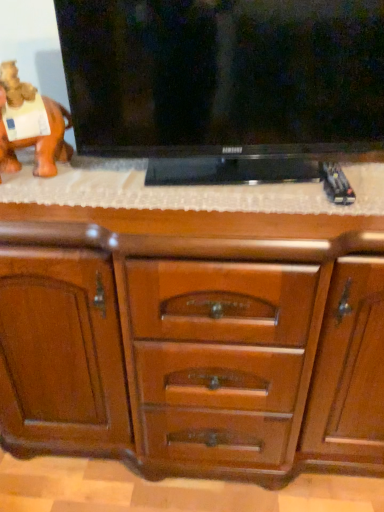
Question: Should I look upward or downward to see black glossy flat-screen tv at upper center?

Choices:
 (A) down
 (B) up

Answer: (B)

Question: Is there a large distance between wooden chest of drawers at center and black glossy flat-screen tv at upper center?

Choices:
 (A) yes
 (B) no

Answer: (B)

Question: From the image's perspective, does wooden chest of drawers at center appear lower than black glossy flat-screen tv at upper center?

Choices:
 (A) no
 (B) yes

Answer: (B)

Question: Can you see wooden chest of drawers at center touching black glossy flat-screen tv at upper center?

Choices:
 (A) yes
 (B) no

Answer: (B)

Question: Is wooden chest of drawers at center to the right of black glossy flat-screen tv at upper center from the viewer's perspective?

Choices:
 (A) yes
 (B) no

Answer: (B)

Question: Could you tell me if wooden chest of drawers at center is turned towards black glossy flat-screen tv at upper center?

Choices:
 (A) no
 (B) yes

Answer: (A)

Question: Is wooden chest of drawers at center outside of black glossy flat-screen tv at upper center?

Choices:
 (A) yes
 (B) no

Answer: (A)

Question: Is wooden chest of drawers at center positioned before orange matte elephant at left?

Choices:
 (A) yes
 (B) no

Answer: (A)

Question: Is orange matte elephant at left inside wooden chest of drawers at center?

Choices:
 (A) no
 (B) yes

Answer: (A)

Question: Does wooden chest of drawers at center have a greater height compared to orange matte elephant at left?

Choices:
 (A) yes
 (B) no

Answer: (A)

Question: Does wooden chest of drawers at center appear on the right side of orange matte elephant at left?

Choices:
 (A) yes
 (B) no

Answer: (A)

Question: Can you confirm if wooden chest of drawers at center is wider than orange matte elephant at left?

Choices:
 (A) no
 (B) yes

Answer: (B)

Question: From a real-world perspective, is wooden chest of drawers at center located higher than orange matte elephant at left?

Choices:
 (A) no
 (B) yes

Answer: (A)

Question: Is black glossy flat-screen tv at upper center positioned with its back to wooden chest of drawers at center?

Choices:
 (A) yes
 (B) no

Answer: (B)